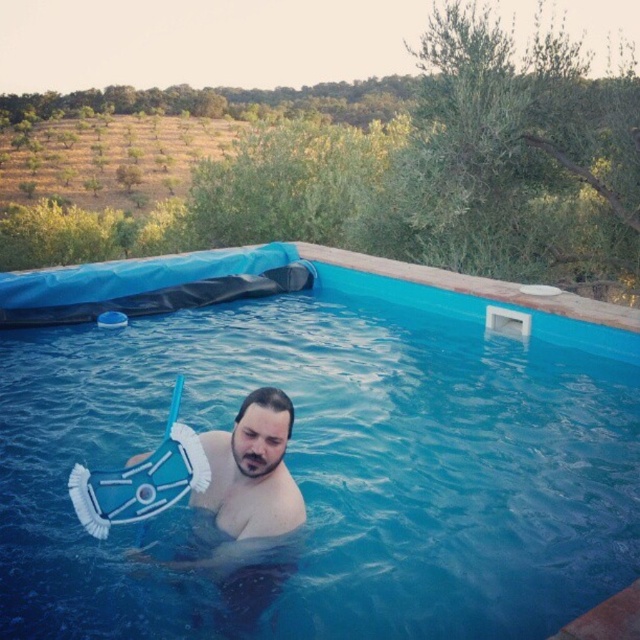
You are standing near the pool and want to check the distance to the point marked as point (177, 348). Can you estimate how far it is from your current position?

The point (177, 348) is 20.24 feet away from the viewer, so the distance is approximately 20.24 feet.

You are a lifeguard who needs to retrieve the blue plastic snorkel at center from the blue plastic pool at center. Which direction should you move to reach the snorkel first?

The blue plastic pool at center is positioned on the right side of the blue plastic snorkel at center, so you should move to the left to reach the snorkel first.

You are designing a storage container for the blue plastic pool at center and the blue plastic snorkel at center. Which item requires a larger storage space based on their sizes?

The blue plastic snorkel at center requires a larger storage space because it occupies more space than the blue plastic pool at center according to the description.